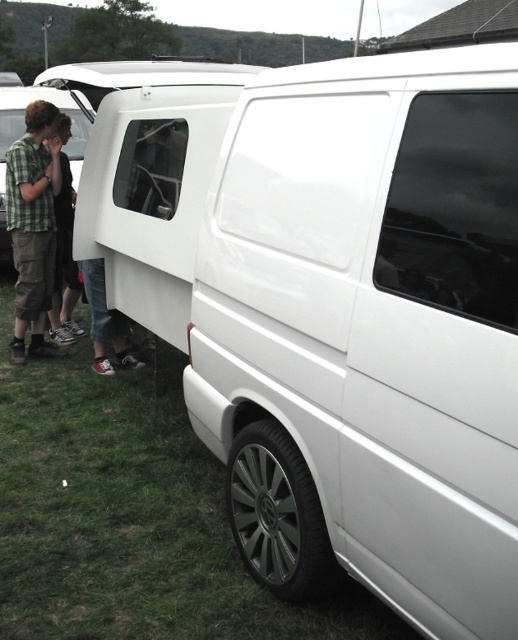
From the picture: Is green plaid shirt at left further to the viewer compared to matte black van at left?

No.

Measure the distance between point [21,346] and camera.

Point [21,346] and camera are 5.22 meters apart from each other.

Which is in front, point (19, 241) or point (5, 232)?

Positioned in front is point (19, 241).

I want to click on green plaid shirt at left, so click(33, 225).

Does white glossy van at center have a lesser height compared to green plaid shirt at left?

No.

Is white glossy van at center below green plaid shirt at left?

Yes.

Is point (514, 344) positioned behind point (44, 317)?

No, (514, 344) is closer to viewer.

The width and height of the screenshot is (518, 640). I want to click on white glossy van at center, so click(368, 332).

Can you confirm if white glossy van at center is positioned below matte black van at left?

Indeed, white glossy van at center is positioned under matte black van at left.

Is white glossy van at center wider than matte black van at left?

No.

Measure the distance between point [471,374] and camera.

1.55 meters

Identify the location of white glossy van at center. (368, 332).